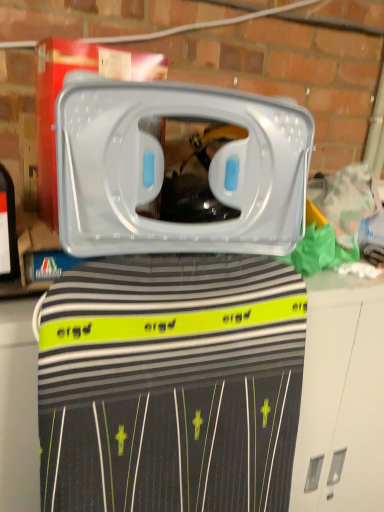
Describe the element at coordinates (163, 169) in the screenshot. I see `transparent plastic container at center` at that location.

At what (x,y) coordinates should I click in order to perform the action: click on transparent plastic container at center. Please return your answer as a coordinate pair (x, y). Image resolution: width=384 pixels, height=512 pixels. Looking at the image, I should click on (163, 169).

Measure the distance between transparent plastic container at center and camera.

A distance of 21.87 inches exists between transparent plastic container at center and camera.

Identify the location of black striped fabric at center. This screenshot has height=512, width=384. (171, 384).

Describe the element at coordinates (171, 384) in the screenshot. I see `black striped fabric at center` at that location.

Where is `transparent plastic container at center`? transparent plastic container at center is located at coordinates (163, 169).

Considering the relative positions of black striped fabric at center and transparent plastic container at center in the image provided, is black striped fabric at center to the left or to the right of transparent plastic container at center?

Based on their positions, black striped fabric at center is located to the right of transparent plastic container at center.

Is the position of black striped fabric at center less distant than that of transparent plastic container at center?

That is False.

Which is behind, point (219, 300) or point (225, 233)?

The point (219, 300) is behind.

From the image's perspective, which is below, black striped fabric at center or transparent plastic container at center?

black striped fabric at center appears lower in the image.

From a real-world perspective, is black striped fabric at center on transparent plastic container at center?

Incorrect, from a real-world perspective, black striped fabric at center is lower than transparent plastic container at center.

In the scene shown: Does black striped fabric at center have a lesser width compared to transparent plastic container at center?

No.

Between black striped fabric at center and transparent plastic container at center, which one has less height?

With less height is transparent plastic container at center.

Considering the sizes of objects black striped fabric at center and transparent plastic container at center in the image provided, who is smaller, black striped fabric at center or transparent plastic container at center?

Smaller between the two is transparent plastic container at center.

Would you say transparent plastic container at center is part of black striped fabric at center's contents?

Definitely not — transparent plastic container at center is not inside black striped fabric at center.

Is black striped fabric at center touching transparent plastic container at center?

No, black striped fabric at center is not with transparent plastic container at center.

Could you tell me if black striped fabric at center is turned towards transparent plastic container at center?

No, black striped fabric at center is not facing towards transparent plastic container at center.

This screenshot has height=512, width=384. I want to click on home appliance that is above the black striped fabric at center (from the image's perspective), so click(x=163, y=169).

Looking at this image, can you confirm if transparent plastic container at center is positioned to the left of black striped fabric at center?

Yes.

Is transparent plastic container at center closer to the viewer compared to black striped fabric at center?

Yes, the depth of transparent plastic container at center is less than that of black striped fabric at center.

Is point (259, 131) closer or farther from the camera than point (59, 394)?

Point (259, 131) is farther from the camera than point (59, 394).

From the image's perspective, is transparent plastic container at center located above black striped fabric at center?

Yes, from the image's perspective, transparent plastic container at center is above black striped fabric at center.

From a real-world perspective, is transparent plastic container at center positioned under black striped fabric at center based on gravity?

Incorrect, from a real-world perspective, transparent plastic container at center is higher than black striped fabric at center.

Considering the sizes of transparent plastic container at center and black striped fabric at center in the image, is transparent plastic container at center wider or thinner than black striped fabric at center?

transparent plastic container at center is thinner than black striped fabric at center.

Can you confirm if transparent plastic container at center is shorter than black striped fabric at center?

Correct, transparent plastic container at center is not as tall as black striped fabric at center.

Consider the image. Is transparent plastic container at center bigger than black striped fabric at center?

Incorrect, transparent plastic container at center is not larger than black striped fabric at center.

In the scene shown: Is black striped fabric at center located within transparent plastic container at center?

No.

Is transparent plastic container at center not close to black striped fabric at center?

No.

Based on the photo, could you tell me if transparent plastic container at center is turned towards black striped fabric at center?

No, transparent plastic container at center is not oriented towards black striped fabric at center.

Can you tell me how much transparent plastic container at center and black striped fabric at center differ in facing direction?

5.95 degrees separate the facing orientations of transparent plastic container at center and black striped fabric at center.

Measure the distance between transparent plastic container at center and black striped fabric at center.

A distance of 7.52 inches exists between transparent plastic container at center and black striped fabric at center.

Identify the location of clothing below the transparent plastic container at center (from a real-world perspective). (171, 384).

Where is `home appliance in front of the black striped fabric at center`? The image size is (384, 512). home appliance in front of the black striped fabric at center is located at coordinates (163, 169).

Find the location of a particular element. The width and height of the screenshot is (384, 512). clothing below the transparent plastic container at center (from the image's perspective) is located at coordinates (171, 384).